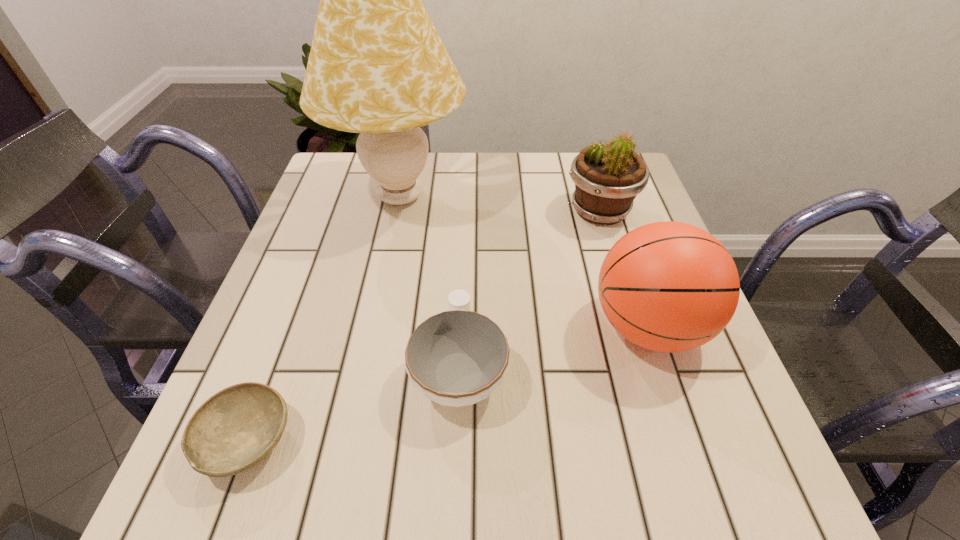
Find the location of a particular element. Image resolution: width=960 pixels, height=540 pixels. vacant area between the basketball and the tallest object is located at coordinates (524, 262).

Identify the location of free space between the basketball and the lampshade. The image size is (960, 540). (524, 262).

I want to click on free space between the lampshade and the flowerpot, so click(x=500, y=204).

Locate which object ranks fourth in proximity to the bowl. Please provide its 2D coordinates. Your answer should be formatted as a tuple, i.e. [(x, y)], where the tuple contains the x and y coordinates of a point satisfying the conditions above.

[(607, 179)]

This screenshot has width=960, height=540. What are the coordinates of `object that is the fourth closest one to the flowerpot` in the screenshot? It's located at (235, 429).

Identify the location of vacant space that satisfies the following two spatial constraints: 1. on the front side of the basketball; 2. on the right side of the flowerpot. (636, 327).

Identify the location of vacant space that satisfies the following two spatial constraints: 1. on the side with the handle of the fourth tallest object; 2. on the right side of the basketball. This screenshot has height=540, width=960. click(x=461, y=327).

I want to click on vacant space that satisfies the following two spatial constraints: 1. on the back side of the shortest object; 2. on the left side of the flowerpot, so click(x=334, y=211).